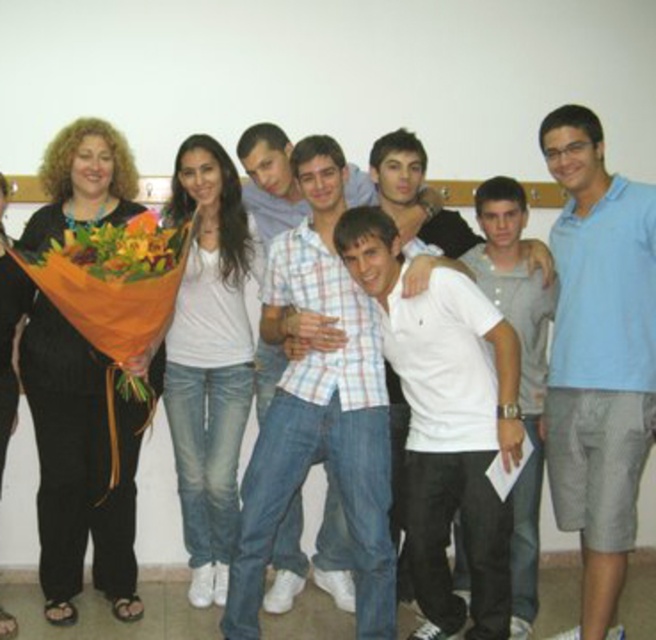
In the group photo, you notice two shirts at the center of the image. The plaid shirt at center and the white cotton shirt at center. Which one appears larger?

The plaid shirt at center is bigger than the white cotton shirt at center, so the plaid shirt at center appears larger.

You are standing in the room where the group is posing. You want to move from the point at coordinates point (264,435) to the point at coordinates point (529,630). Which direction should you move to get closer to your destination?

To move from point (264,435) to point (529,630), you should move towards the upper right direction since point (529,630) is further away from the viewer compared to point (264,435).